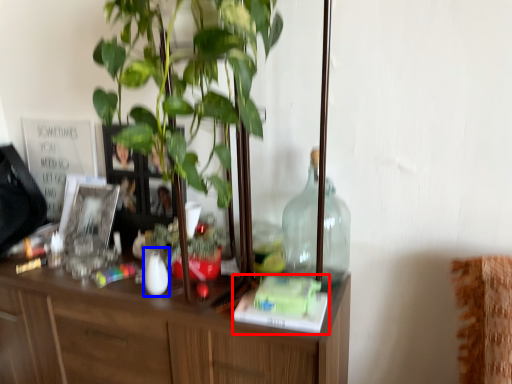
Question: Which object is further to the camera taking this photo, book (highlighted by a red box) or vase (highlighted by a blue box)?

Choices:
 (A) book
 (B) vase

Answer: (B)